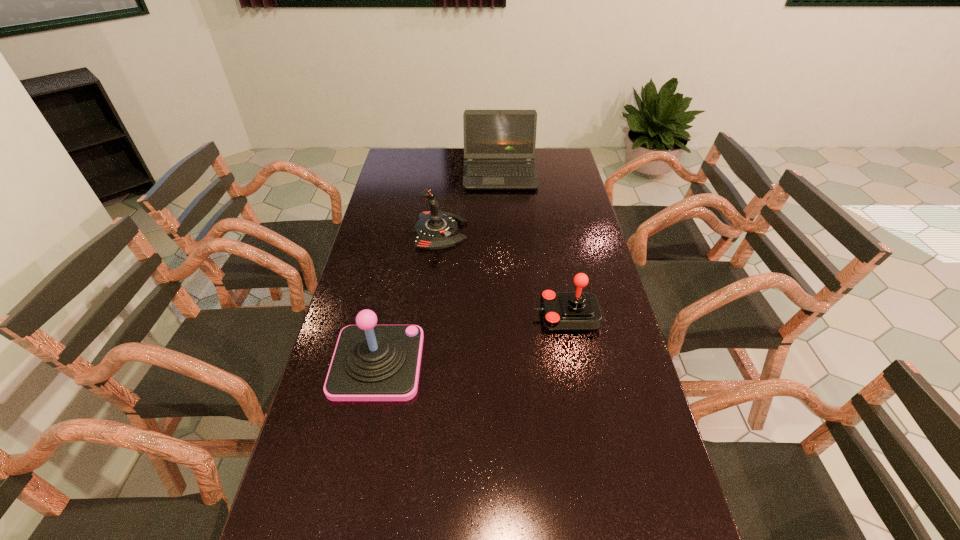
You are a GUI agent. You are given a task and a screenshot of the screen. Output one action in this format:
    pyautogui.click(x=<x>, y=<y>)
    Task: Click on the farthest object
    
    Given the screenshot: What is the action you would take?
    pyautogui.click(x=499, y=145)

You are a GUI agent. You are given a task and a screenshot of the screen. Output one action in this format:
    pyautogui.click(x=<x>, y=<y>)
    Task: Click on the farthest joystick
    The height and width of the screenshot is (540, 960).
    Given the screenshot: What is the action you would take?
    pyautogui.click(x=435, y=229)

This screenshot has width=960, height=540. In order to click on the rightmost joystick in this screenshot , I will do `click(578, 311)`.

Find the location of a particular element. vacant space located on the screen of the laptop_computer is located at coordinates pyautogui.click(x=502, y=209).

Locate an element on the screen. free region located on the handle side of the farthest joystick is located at coordinates (489, 232).

This screenshot has height=540, width=960. I want to click on vacant space located 0.230m on the base of the rightmost joystick, so pos(457,316).

The width and height of the screenshot is (960, 540). What are the coordinates of `vacant region located on the base of the rightmost joystick` in the screenshot? It's located at (497, 316).

Identify the location of free space located on the base of the rightmost joystick. (477, 316).

The height and width of the screenshot is (540, 960). I want to click on object that is at the far edge, so click(499, 145).

Where is `object present at the left edge`? Image resolution: width=960 pixels, height=540 pixels. object present at the left edge is located at coordinates (371, 362).